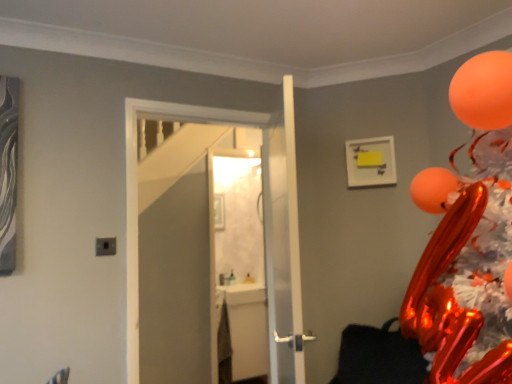
What do you see at coordinates (138, 196) in the screenshot?
I see `transparent glass door at center` at bounding box center [138, 196].

Identify the location of transparent glass door at center. The height and width of the screenshot is (384, 512). (138, 196).

I want to click on transparent glass door at center, so click(x=138, y=196).